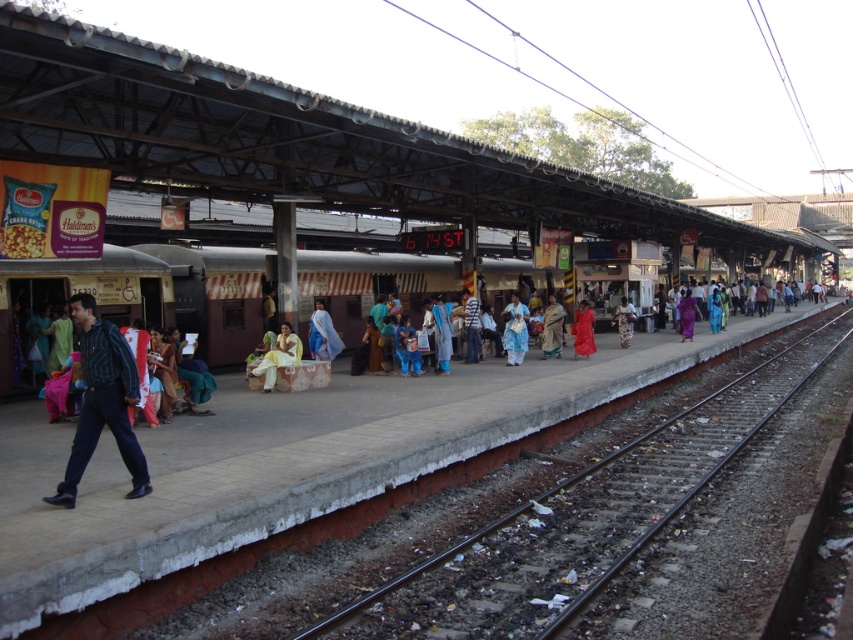
You are a photographer standing on the platform and want to take a photo of the white cotton dress at center without the smooth metal train track at center appearing in the background. Given that the dress is 21.70 feet away from the track, is it possible to position yourself such that the track is out of the frame?

Yes, since the white cotton dress at center and smooth metal train track at center are 21.70 feet apart, positioning yourself at a distance where the dress is in focus and the track is beyond the camera frame or out of the depth of field could achieve this.

You are a photographer standing on the platform and want to capture both the blue fabric saree at center and the light blue shirt at center in your shot. Which object is shorter so you can adjust your camera angle accordingly?

The blue fabric saree at center is shorter than the light blue shirt at center, so you should adjust your camera angle to ensure both are visible in the frame.

You are a photographer standing on the platform and want to capture both the blue fabric saree at center and the light blue shirt at center in the same frame. Given that your camera has a 50mm lens, which has a field of view of approximately 46 degrees, can you fit both subjects into the frame without moving closer or further away?

The distance between the blue fabric saree at center and the light blue shirt at center is 3.83 feet. With a 50mm lens having a 46 degree field of view, the maximum distance between two subjects that can be captured in the same frame depends on your distance from them. However, since both subjects are at the same central position on the platform, they are already close enough to each other to be within the camera lens field of view. Therefore, you can capture both in the same frame without needing to adjust